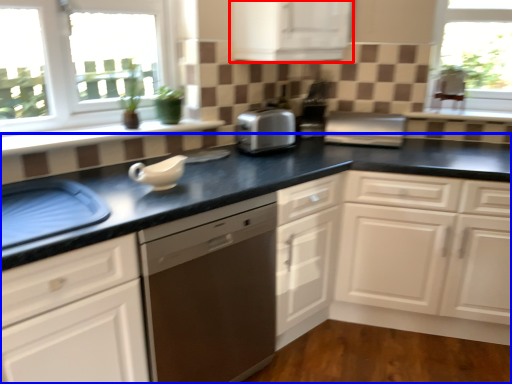
Question: Among these objects, which one is farthest to the camera, cabinetry (highlighted by a red box) or countertop (highlighted by a blue box)?

Choices:
 (A) cabinetry
 (B) countertop

Answer: (A)